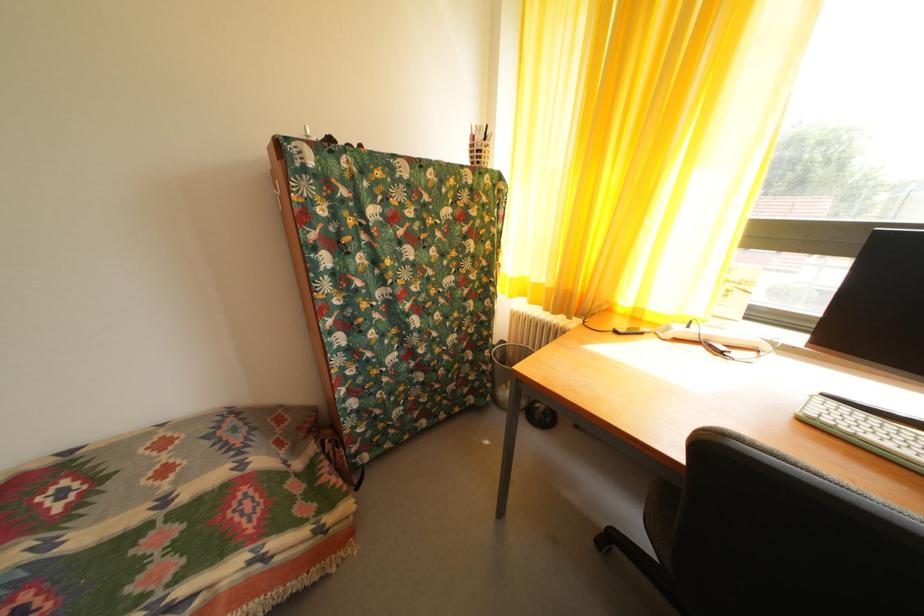
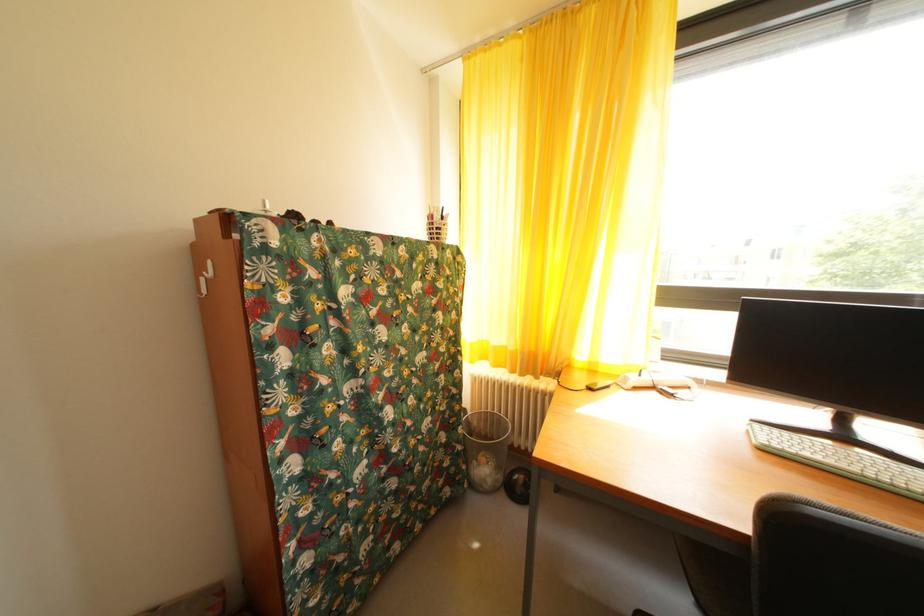
Question: The first image is from the beginning of the video and the second image is from the end. How did the camera likely rotate when shooting the video?

Choices:
 (A) Left
 (B) Right
 (C) Up
 (D) Down

Answer: (B)